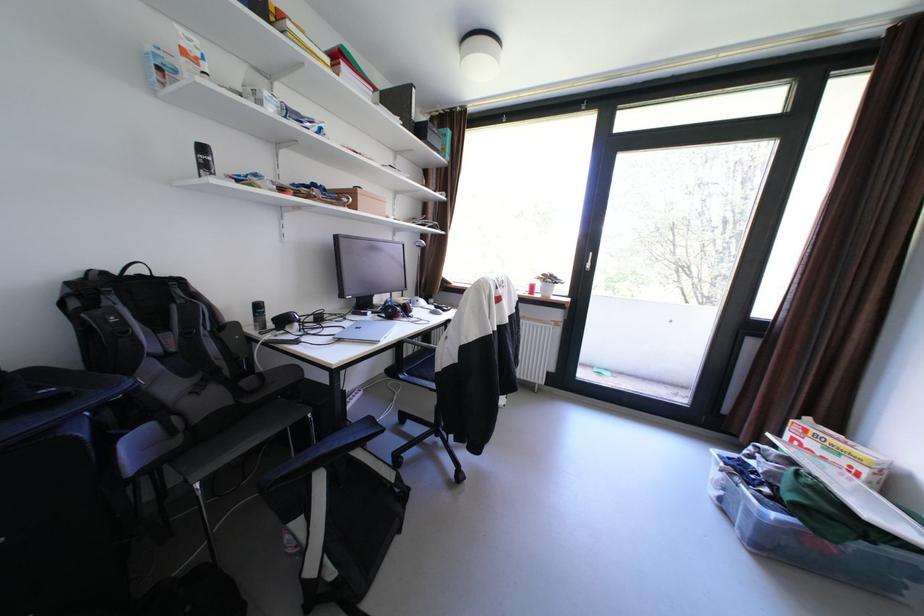
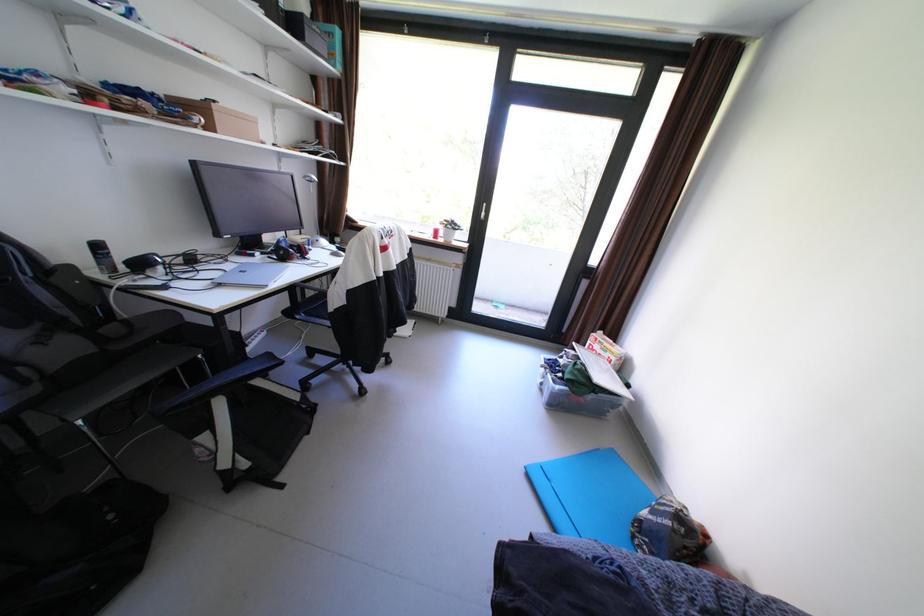
Locate, in the second image, the point that corresponds to point (349, 330) in the first image.

(229, 273)